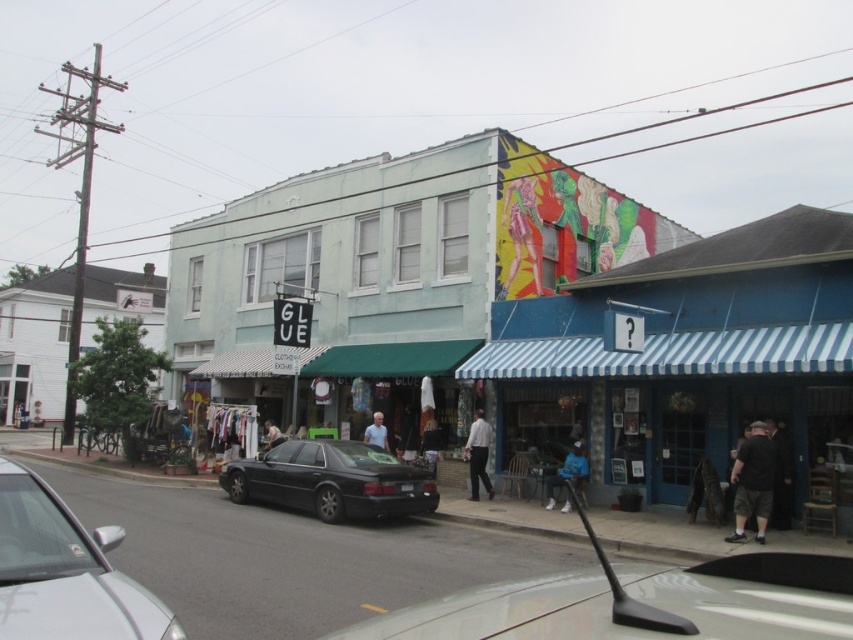
You are a delivery person who needs to place a white cotton shirt at center into a storage box that can only hold items within a 50 feet radius. Can you safely place the shirt into the box?

The white cotton shirt at center is 49.25 feet away, which is within the 50 feet radius, so yes, you can safely place the shirt into the box.

You are a customer looking to buy a shirt. You see a white cotton shirt at center and a gray fabric shirt at center. Which shirt is wider?

The white cotton shirt at center might be wider than gray fabric shirt at center according to the description.